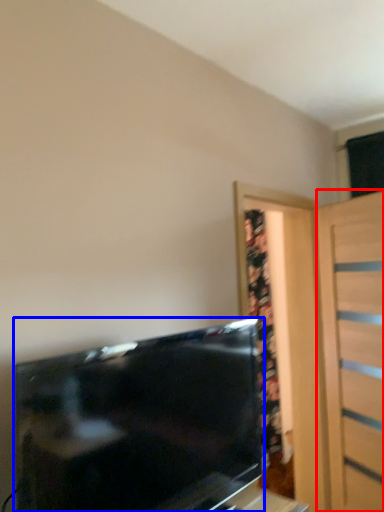
Question: Which object is further to the camera taking this photo, door (highlighted by a red box) or television (highlighted by a blue box)?

Choices:
 (A) door
 (B) television

Answer: (A)